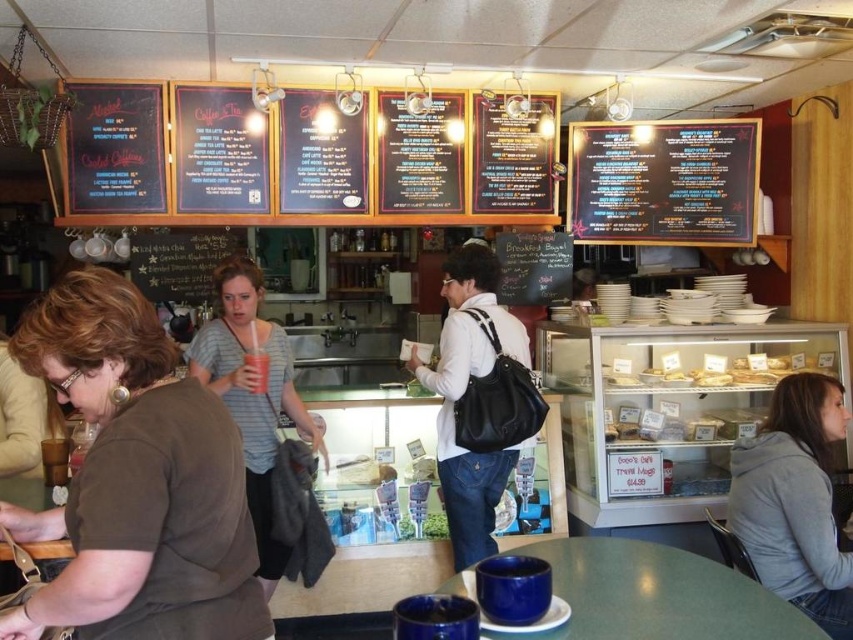
Can you confirm if black leather backpack at center is smaller than gray fleece jacket at lower right?

No.

Is point (476, 538) positioned behind point (757, 518)?

Yes, point (476, 538) is farther from viewer.

I want to click on black leather backpack at center, so click(x=479, y=401).

Measure the distance between brown matte shirt at lower left and striped cotton shirt at center.

brown matte shirt at lower left is 1.38 meters away from striped cotton shirt at center.

Based on the photo, does brown matte shirt at lower left appear over striped cotton shirt at center?

Yes.

At what (x,y) coordinates should I click in order to perform the action: click on brown matte shirt at lower left. Please return your answer as a coordinate pair (x, y). Image resolution: width=853 pixels, height=640 pixels. Looking at the image, I should click on (136, 481).

Identify the location of brown matte shirt at lower left. This screenshot has height=640, width=853. (136, 481).

Measure the distance between black chalkboard menu at upper right and striped cotton shirt at center.

They are 1.82 meters apart.

From the picture: Does black chalkboard menu at upper right have a smaller size compared to striped cotton shirt at center?

Yes, black chalkboard menu at upper right is smaller than striped cotton shirt at center.

Is point (569, 144) farther from viewer compared to point (231, 362)?

Yes, point (569, 144) is behind point (231, 362).

Where is `black chalkboard menu at upper right`? black chalkboard menu at upper right is located at coordinates (663, 182).